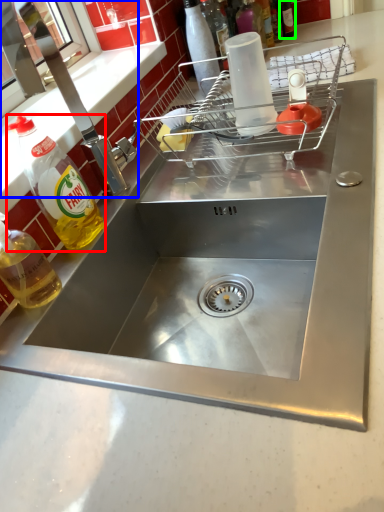
Question: Which object is the farthest from bottle (highlighted by a red box)? Choose among these: tap (highlighted by a blue box) or bottle (highlighted by a green box).

Choices:
 (A) tap
 (B) bottle

Answer: (B)